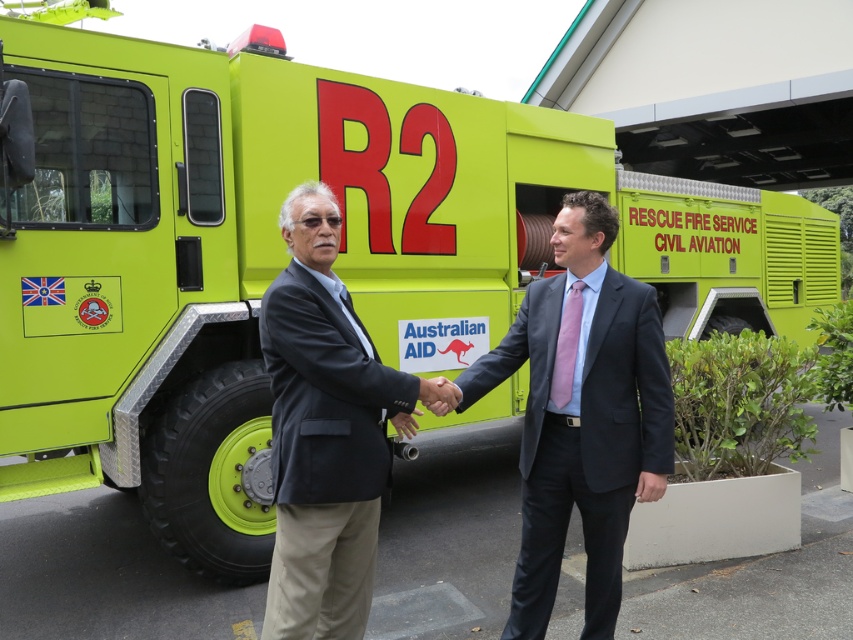
Is point (560, 476) positioned behind point (372, 362)?

Yes, it is behind point (372, 362).

Does dark blue suit at center lie behind dark gray suit at center?

Yes, dark blue suit at center is further from the viewer.

Is point (631, 380) in front of point (372, 529)?

No.

Locate an element on the screen. dark blue suit at center is located at coordinates (582, 416).